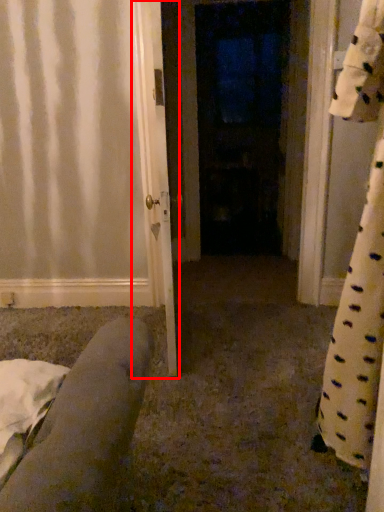
Question: From the image's perspective, considering the relative positions of door (annotated by the red box) and door in the image provided, where is door (annotated by the red box) located with respect to the staircase?

Choices:
 (A) above
 (B) below

Answer: (B)